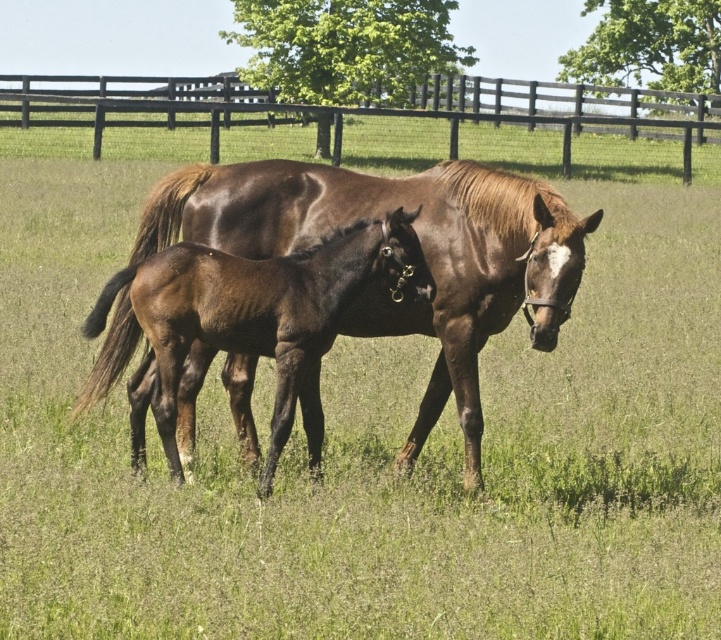
Does brown glossy horse at center lie in front of brown wooden fence at upper center?

Yes, brown glossy horse at center is closer to the viewer.

Is brown glossy horse at center smaller than brown wooden fence at upper center?

Yes.

Is point (252, 424) farther from camera compared to point (441, 115)?

No, it is not.

Locate an element on the screen. The width and height of the screenshot is (721, 640). brown glossy horse at center is located at coordinates (423, 250).